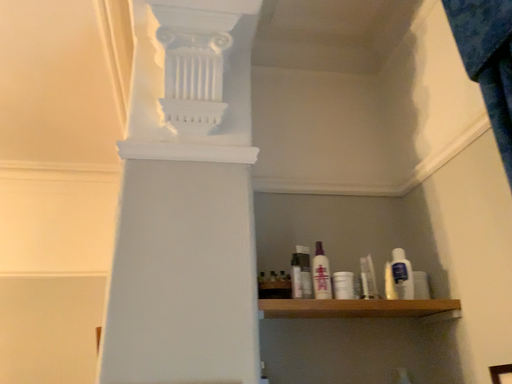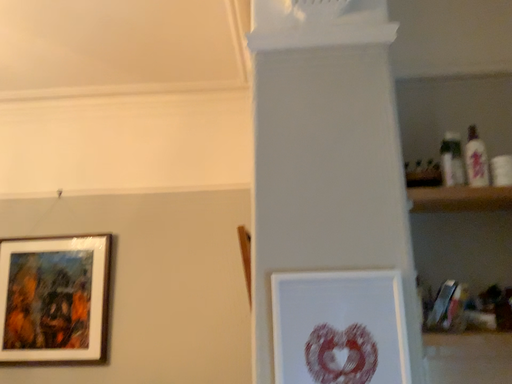
Question: How did the camera likely rotate when shooting the video?

Choices:
 (A) rotated right
 (B) rotated left

Answer: (B)